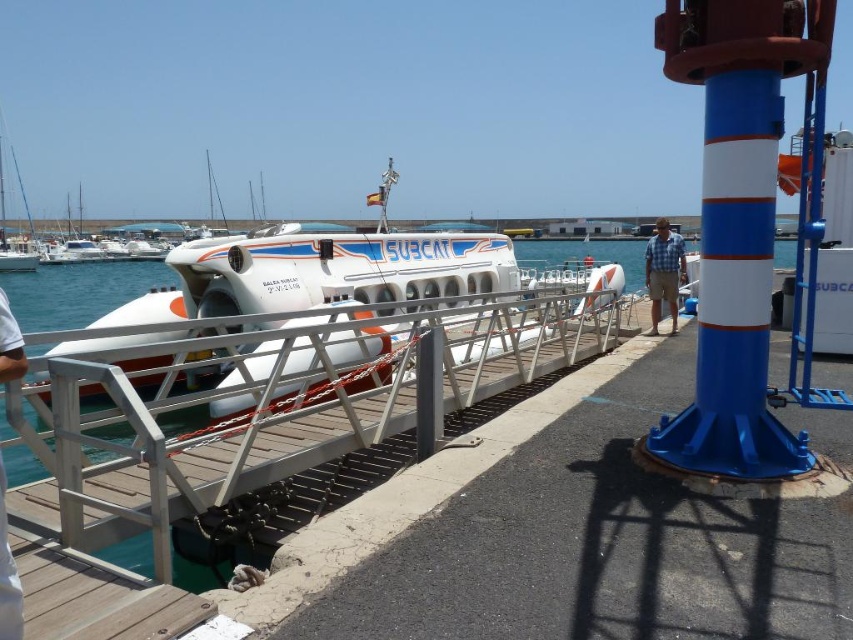
Question: Can you confirm if silver metallic rail at center is smaller than white fabric pants at lower left?

Choices:
 (A) no
 (B) yes

Answer: (B)

Question: Which of the following is the closest to the observer?

Choices:
 (A) skinny jeans at lower left
 (B) white fabric pants at lower left
 (C) white glossy submarine at center

Answer: (B)

Question: Does white glossy submarine at center lie behind skinny jeans at lower left?

Choices:
 (A) yes
 (B) no

Answer: (A)

Question: Observing the image, what is the correct spatial positioning of silver metallic rail at center in reference to white fabric pants at lower left?

Choices:
 (A) right
 (B) left

Answer: (A)

Question: Among these points, which one is nearest to the camera?

Choices:
 (A) (18, 353)
 (B) (4, 296)

Answer: (B)

Question: Which object appears closest to the camera in this image?

Choices:
 (A) skinny jeans at lower left
 (B) blue checkered shirt at center

Answer: (A)